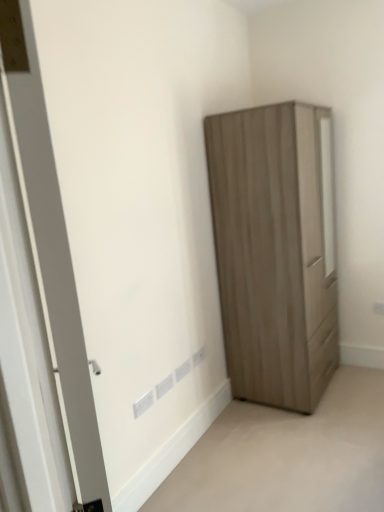
In order to click on free location above matte wood wardrobe at lower right (from a real-world perspective) in this screenshot , I will do `click(286, 449)`.